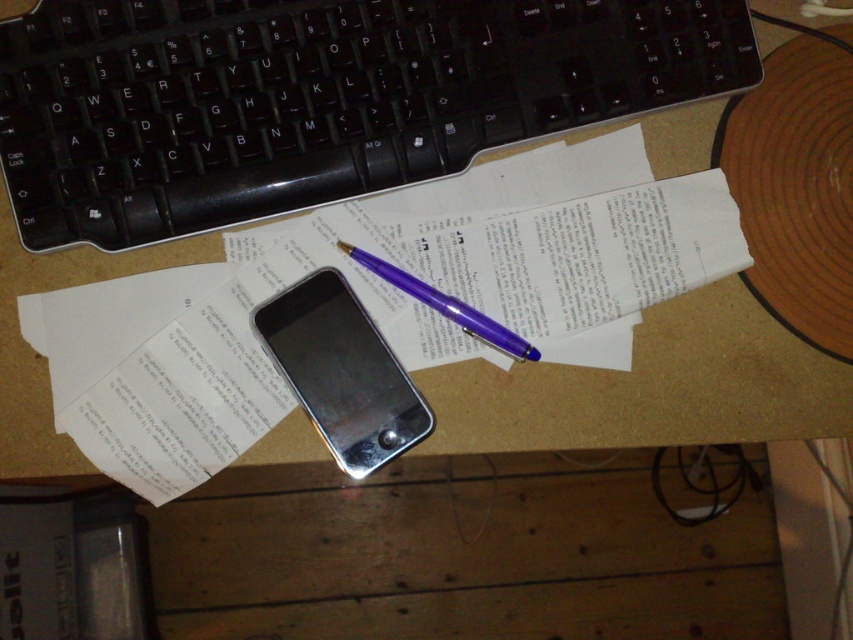
Question: In this image, where is black plastic keyboard at upper center located relative to purple glossy pen at center?

Choices:
 (A) above
 (B) below

Answer: (A)

Question: Which is farther from the purple glossy pen at center?

Choices:
 (A) white paper at center
 (B) black plastic keyboard at upper center
 (C) silver metallic smartphone at center

Answer: (B)

Question: Which of the following is the farthest from the observer?

Choices:
 (A) (408, 275)
 (B) (305, 410)
 (C) (567, 116)

Answer: (A)

Question: Considering the real-world distances, which object is closest to the white paper at center?

Choices:
 (A) purple glossy pen at center
 (B) silver metallic smartphone at center
 (C) black plastic keyboard at upper center

Answer: (C)

Question: Does white paper at center have a greater width compared to purple glossy pen at center?

Choices:
 (A) no
 (B) yes

Answer: (B)

Question: Does black plastic keyboard at upper center appear over white paper at center?

Choices:
 (A) no
 (B) yes

Answer: (B)